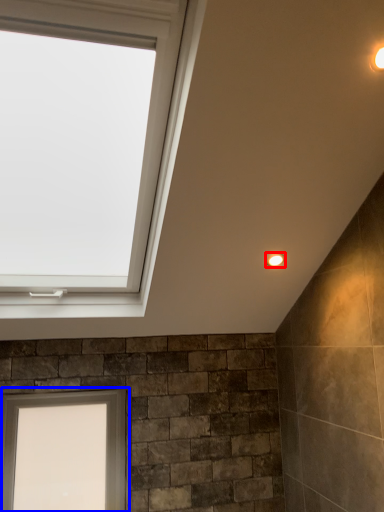
Question: Which point is further to the camera, light fixture (highlighted by a red box) or window (highlighted by a blue box)?

Choices:
 (A) light fixture
 (B) window

Answer: (B)